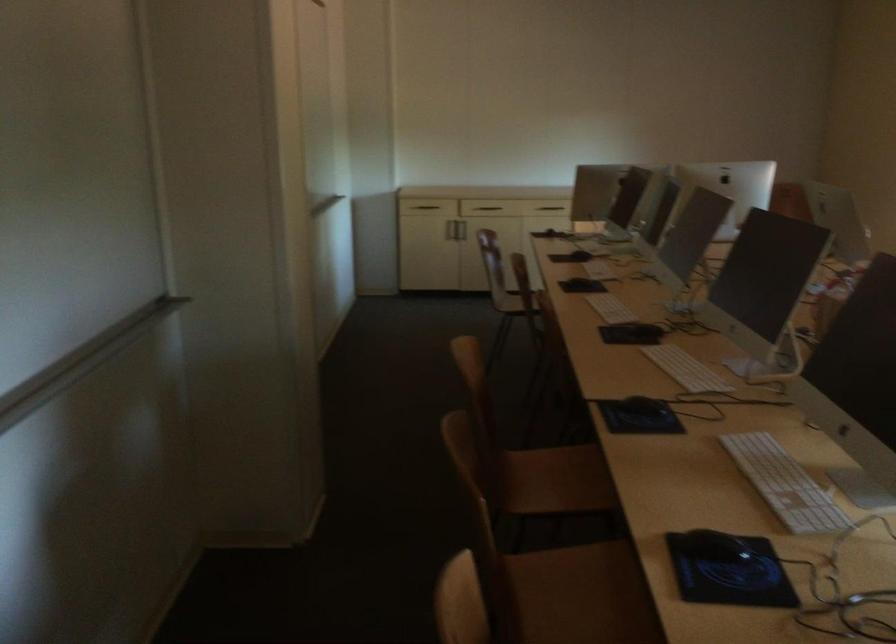
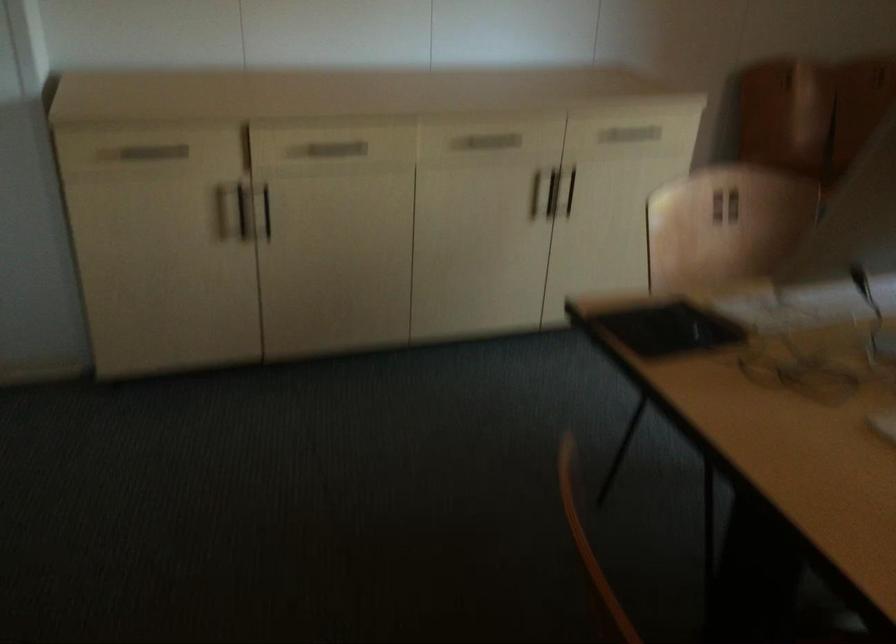
Question: I am providing you with two images of the same scene from different viewpoints. Please identify which objects are invisible in image2.

Choices:
 (A) metal cabinet handle
 (B) vertical cabinet handle
 (C) thin metal rod
 (D) black tablet

Answer: (A)